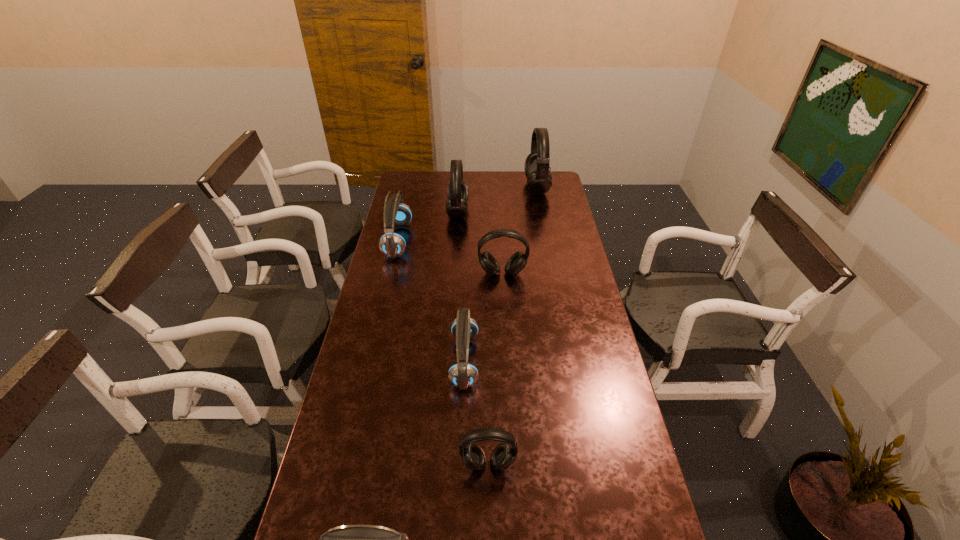
The width and height of the screenshot is (960, 540). In order to click on the second nearest object in this screenshot , I will do `click(503, 456)`.

Where is `free spot located 0.390m on the earcups of the tallest object`? free spot located 0.390m on the earcups of the tallest object is located at coordinates (449, 187).

I want to click on blank space located on the earcups of the tallest object, so click(x=510, y=187).

Identify the location of vacant space situated on the earcups of the tallest object. The width and height of the screenshot is (960, 540). (491, 187).

Locate an element on the screen. vacant space located 0.050m on the earcups of the leftmost gray headset is located at coordinates (479, 212).

Find the location of `vacant space located on the ear cups of the farthest blue headset`. vacant space located on the ear cups of the farthest blue headset is located at coordinates (428, 240).

Find the location of a particular element. The image size is (960, 540). vacant space located on the earcups of the fourth nearest object is located at coordinates (506, 329).

At what (x,y) coordinates should I click in order to perform the action: click on vacant space situated 0.300m on the ear cups of the rightmost blue headset. Please return your answer as a coordinate pair (x, y). The image size is (960, 540). Looking at the image, I should click on (570, 360).

Image resolution: width=960 pixels, height=540 pixels. I want to click on vacant space located 0.100m on the earcups of the nearest gray headset, so click(x=489, y=515).

The height and width of the screenshot is (540, 960). Find the location of `object located in the far edge section of the desktop`. object located in the far edge section of the desktop is located at coordinates (539, 179).